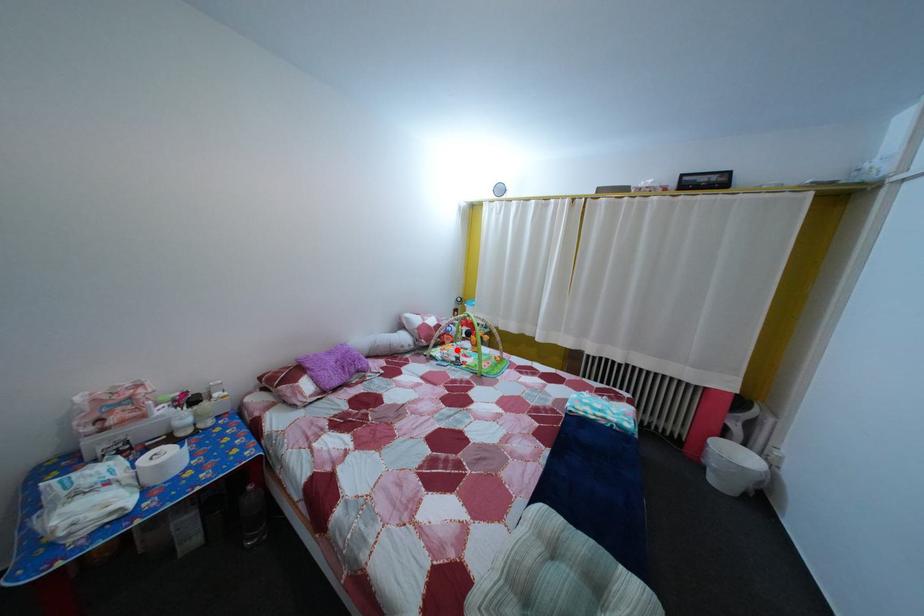
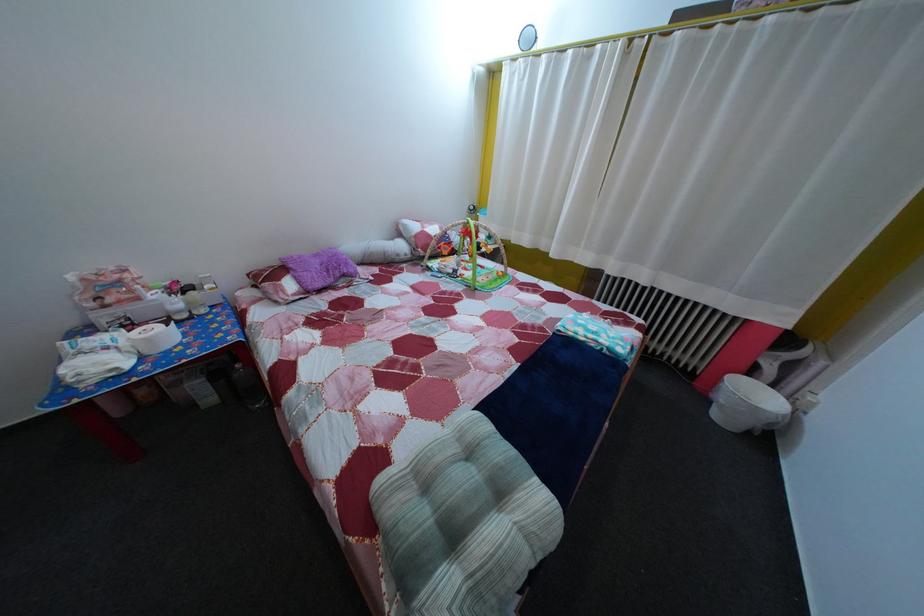
Question: I am providing you with two images of the same scene from different viewpoints. In image1, a red point is highlighted. Considering the same 3D point in image2, which of the following is correct?

Choices:
 (A) It is closer
 (B) It is farther

Answer: (A)